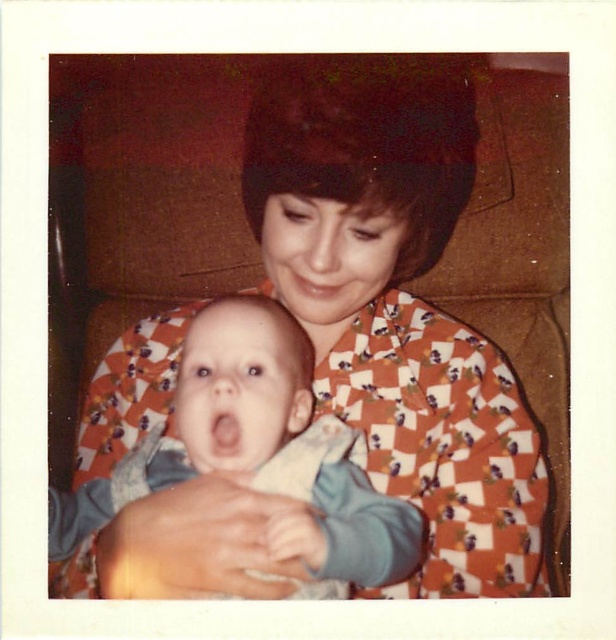
Question: Is orange printed fabric at center below blue cotton baby at center?

Choices:
 (A) yes
 (B) no

Answer: (B)

Question: Which of the following is the closest to the observer?

Choices:
 (A) [x=195, y=356]
 (B) [x=456, y=129]

Answer: (A)

Question: Which point is farther to the camera?

Choices:
 (A) (500, 365)
 (B) (341, 429)

Answer: (A)

Question: Is orange printed fabric at center wider than blue cotton baby at center?

Choices:
 (A) no
 (B) yes

Answer: (B)

Question: Can you confirm if orange printed fabric at center is wider than blue cotton baby at center?

Choices:
 (A) yes
 (B) no

Answer: (A)